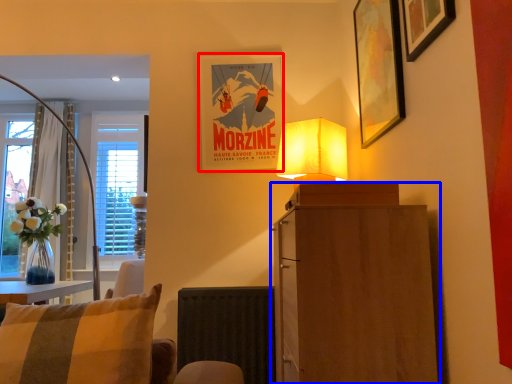
Question: Which of the following is the farthest to the observer, picture frame (highlighted by a red box) or cabinetry (highlighted by a blue box)?

Choices:
 (A) picture frame
 (B) cabinetry

Answer: (A)